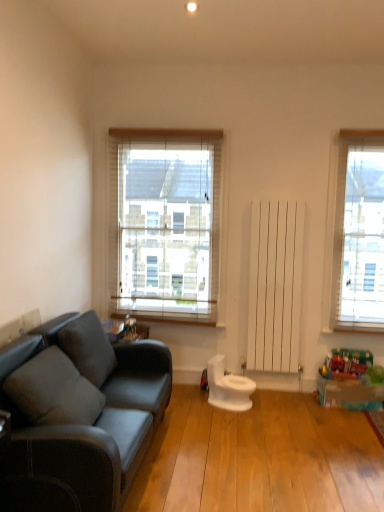
Measure the distance between translucent plastic toy at lower right, acting as the first toy starting from the bottom, and camera.

The depth of translucent plastic toy at lower right, acting as the first toy starting from the bottom, is 11.03 feet.

What do you see at coordinates (53, 391) in the screenshot?
I see `soft gray cushion at left, which ranks as the 2th pillow in back-to-front order` at bounding box center [53, 391].

What do you see at coordinates (165, 223) in the screenshot? I see `white wood blinds at center` at bounding box center [165, 223].

What do you see at coordinates (88, 347) in the screenshot? This screenshot has width=384, height=512. I see `gray fabric pillow at left, marked as the second pillow in a front-to-back arrangement` at bounding box center [88, 347].

Where is `gray fabric pillow at left, the first pillow when ordered from back to front`? gray fabric pillow at left, the first pillow when ordered from back to front is located at coordinates (88, 347).

Locate an element on the screen. The height and width of the screenshot is (512, 384). metallic silver toy at center, the first toy in the left-to-right sequence is located at coordinates (129, 328).

How different are the orientations of white glossy toilet at center and metallic silver toy at center, the 2th toy positioned from the bottom, in degrees?

The angle between the facing direction of white glossy toilet at center and the facing direction of metallic silver toy at center, the 2th toy positioned from the bottom, is 23.4 degrees.

From a real-world perspective, is white glossy toilet at center over metallic silver toy at center, the 2th toy positioned from the bottom?

Actually, white glossy toilet at center is physically below metallic silver toy at center, the 2th toy positioned from the bottom, in the real world.

Based on the photo, is white glossy toilet at center not inside metallic silver toy at center, which is the first toy in top-to-bottom order?

Absolutely, white glossy toilet at center is external to metallic silver toy at center, which is the first toy in top-to-bottom order.

Based on the photo, considering the sizes of objects white glossy toilet at center and metallic silver toy at center, which is the second toy from right to left, in the image provided, who is thinner, white glossy toilet at center or metallic silver toy at center, which is the second toy from right to left,?

Thinner between the two is metallic silver toy at center, which is the second toy from right to left.

In the scene shown: Is white wood blinds at center touching gray fabric pillow at left, the first pillow when ordered from back to front?

No, white wood blinds at center is not with gray fabric pillow at left, the first pillow when ordered from back to front.

Which is closer to the camera, (168, 276) or (105, 369)?

Point (168, 276) is farther from the camera than point (105, 369).

In the scene shown: From the image's perspective, relative to gray fabric pillow at left, the first pillow when ordered from back to front, is white wood blinds at center above or below?

Based on their image positions, white wood blinds at center is located above gray fabric pillow at left, the first pillow when ordered from back to front.

Considering the positions of objects white wood blinds at center and gray fabric pillow at left, the first pillow when ordered from back to front, in the image provided, who is behind, white wood blinds at center or gray fabric pillow at left, the first pillow when ordered from back to front,?

white wood blinds at center is further from the camera.

From the image's perspective, is gray fabric pillow at left, the first pillow when ordered from back to front, over metallic silver toy at center, the 2th toy positioned from the bottom?

No, from the image's perspective, gray fabric pillow at left, the first pillow when ordered from back to front, is not over metallic silver toy at center, the 2th toy positioned from the bottom.

Could you tell me if gray fabric pillow at left, the first pillow when ordered from back to front, is facing metallic silver toy at center, which is the first toy in top-to-bottom order?

No.

Which is in front, point (63, 341) or point (127, 319)?

The point (63, 341) is in front.

Is metallic silver toy at center, which is the first toy in top-to-bottom order, with white glossy toilet at center?

No, metallic silver toy at center, which is the first toy in top-to-bottom order, is not making contact with white glossy toilet at center.

Is metallic silver toy at center, the first toy in the left-to-right sequence, located outside white glossy toilet at center?

metallic silver toy at center, the first toy in the left-to-right sequence, lies outside white glossy toilet at center's area.

Considering the sizes of objects metallic silver toy at center, which is the second toy from right to left, and white glossy toilet at center in the image provided, who is wider, metallic silver toy at center, which is the second toy from right to left, or white glossy toilet at center?

Wider between the two is white glossy toilet at center.

Is metallic silver toy at center, the first toy in the left-to-right sequence, shorter than white glossy toilet at center?

Indeed, metallic silver toy at center, the first toy in the left-to-right sequence, has a lesser height compared to white glossy toilet at center.

Does white wood blinds at center have a smaller size compared to white glossy toilet at center?

No.

How many degrees apart are the facing directions of white wood blinds at center and white glossy toilet at center?

66.6 degrees.

Identify the location of window lying behind the white glossy toilet at center. This screenshot has height=512, width=384. (165, 223).

Considering their positions, is white wood blinds at center located in front of or behind white glossy toilet at center?

Clearly, white wood blinds at center is behind white glossy toilet at center.

Is soft gray cushion at left, which ranks as the 2th pillow in back-to-front order, at the right side of metallic silver toy at center, which is the second toy from right to left?

Incorrect, soft gray cushion at left, which ranks as the 2th pillow in back-to-front order, is not on the right side of metallic silver toy at center, which is the second toy from right to left.

Based on their sizes in the image, would you say soft gray cushion at left, which ranks as the 2th pillow in back-to-front order, is bigger or smaller than metallic silver toy at center, the first toy in the left-to-right sequence?

Clearly, soft gray cushion at left, which ranks as the 2th pillow in back-to-front order, is larger in size than metallic silver toy at center, the first toy in the left-to-right sequence.

Is soft gray cushion at left, which ranks as the 2th pillow in back-to-front order, oriented towards metallic silver toy at center, the first toy in the left-to-right sequence?

No, soft gray cushion at left, which ranks as the 2th pillow in back-to-front order, does not turn towards metallic silver toy at center, the first toy in the left-to-right sequence.

Is soft gray cushion at left, acting as the 1th pillow starting from the front, next to metallic silver toy at center, the 2th toy positioned from the bottom, and touching it?

soft gray cushion at left, acting as the 1th pillow starting from the front, and metallic silver toy at center, the 2th toy positioned from the bottom, are not in contact.

Is gray fabric pillow at left, marked as the second pillow in a front-to-back arrangement, outside of soft gray cushion at left, which ranks as the 2th pillow in back-to-front order?

Yes.

Could you measure the distance between gray fabric pillow at left, the first pillow when ordered from back to front, and soft gray cushion at left, which ranks as the 2th pillow in back-to-front order?

gray fabric pillow at left, the first pillow when ordered from back to front, and soft gray cushion at left, which ranks as the 2th pillow in back-to-front order, are 14.99 inches apart.

Looking at their sizes, would you say gray fabric pillow at left, the first pillow when ordered from back to front, is wider or thinner than soft gray cushion at left, acting as the 1th pillow starting from the front?

In the image, gray fabric pillow at left, the first pillow when ordered from back to front, appears to be more narrow than soft gray cushion at left, acting as the 1th pillow starting from the front.

Where is `toy located on the left of white glossy toilet at center`? toy located on the left of white glossy toilet at center is located at coordinates (129, 328).

Locate an element on the screen. This screenshot has height=512, width=384. window that is behind the gray fabric pillow at left, the first pillow when ordered from back to front is located at coordinates point(165,223).

From the picture: Which object lies nearer to the anchor point soft gray cushion at left, which ranks as the 2th pillow in back-to-front order, metallic silver toy at center, which is the first toy in top-to-bottom order, or translucent plastic toy at lower right, acting as the first toy starting from the bottom?

metallic silver toy at center, which is the first toy in top-to-bottom order, is closer to soft gray cushion at left, which ranks as the 2th pillow in back-to-front order.

Estimate the real-world distances between objects in this image. Which object is further from translucent plastic toy at lower right, acting as the first toy starting from the bottom, metallic silver toy at center, the 2th toy positioned from the bottom, or soft gray cushion at left, which ranks as the 2th pillow in back-to-front order?

soft gray cushion at left, which ranks as the 2th pillow in back-to-front order.

When comparing their distances from white glossy toilet at center, does soft gray cushion at left, acting as the 1th pillow starting from the front, or white wood blinds at center seem further?

soft gray cushion at left, acting as the 1th pillow starting from the front, is positioned further to the anchor white glossy toilet at center.

From the image, which object appears to be nearer to translucent plastic toy at lower right, the 2th toy viewed from the top, white wood blinds at center or white glossy toilet at center?

white glossy toilet at center.

Looking at the image, which one is located closer to metallic silver toy at center, the 2th toy positioned from the bottom, white wood blinds at center or gray fabric pillow at left, marked as the second pillow in a front-to-back arrangement?

gray fabric pillow at left, marked as the second pillow in a front-to-back arrangement, lies closer to metallic silver toy at center, the 2th toy positioned from the bottom, than the other object.

Which object lies further to the anchor point white glossy toilet at center, white wood blinds at center or gray fabric pillow at left, marked as the second pillow in a front-to-back arrangement?

white wood blinds at center is further to white glossy toilet at center.

Based on their spatial positions, is white wood blinds at center or gray fabric pillow at left, the first pillow when ordered from back to front, further from soft gray cushion at left, acting as the 1th pillow starting from the front?

Based on the image, white wood blinds at center appears to be further to soft gray cushion at left, acting as the 1th pillow starting from the front.

From the image, which object appears to be nearer to white glossy toilet at center, gray fabric pillow at left, marked as the second pillow in a front-to-back arrangement, or metallic silver toy at center, the first toy in the left-to-right sequence?

metallic silver toy at center, the first toy in the left-to-right sequence.

The image size is (384, 512). Identify the location of pillow located between soft gray cushion at left, acting as the 1th pillow starting from the front, and metallic silver toy at center, which is the first toy in top-to-bottom order, in the depth direction. (88, 347).

Locate an element on the screen. window located between gray fabric pillow at left, the first pillow when ordered from back to front, and translucent plastic toy at lower right, acting as the first toy starting from the bottom, in the left-right direction is located at coordinates (165, 223).

Locate an element on the screen. This screenshot has width=384, height=512. pillow between soft gray cushion at left, acting as the 1th pillow starting from the front, and white wood blinds at center from front to back is located at coordinates (88, 347).

Where is `pillow between soft gray cushion at left, acting as the 1th pillow starting from the front, and white glossy toilet at center in the front-back direction`? This screenshot has width=384, height=512. pillow between soft gray cushion at left, acting as the 1th pillow starting from the front, and white glossy toilet at center in the front-back direction is located at coordinates (88, 347).